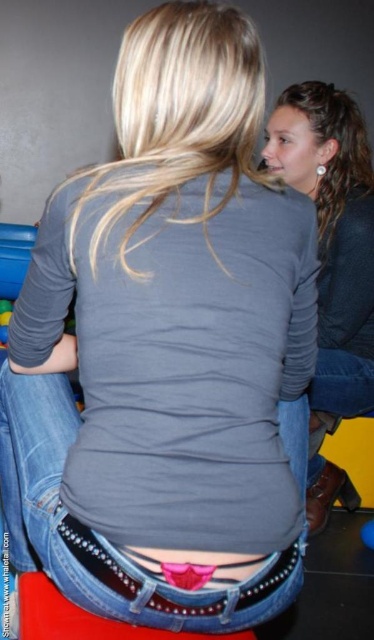
Question: Does jeans at center appear on the right side of matte gray shirt at center?

Choices:
 (A) no
 (B) yes

Answer: (A)

Question: Which point appears farthest from the camera in this image?

Choices:
 (A) [x=41, y=442]
 (B) [x=94, y=628]

Answer: (A)

Question: Among these points, which one is nearest to the camera?

Choices:
 (A) (1, 320)
 (B) (81, 618)
 (C) (74, 532)
 (D) (47, 532)

Answer: (C)

Question: Can you confirm if matte gray shirt at center is positioned above rubberized yellow toy at lower left?

Choices:
 (A) no
 (B) yes

Answer: (B)

Question: From the image, what is the correct spatial relationship of matte gray shirt at center in relation to denim stool at lower center?

Choices:
 (A) below
 (B) above

Answer: (B)

Question: Based on their relative distances, which object is farther from the jeans at center?

Choices:
 (A) matte gray shirt at center
 (B) studded denim belt at lower center
 (C) rubberized yellow toy at lower left

Answer: (C)